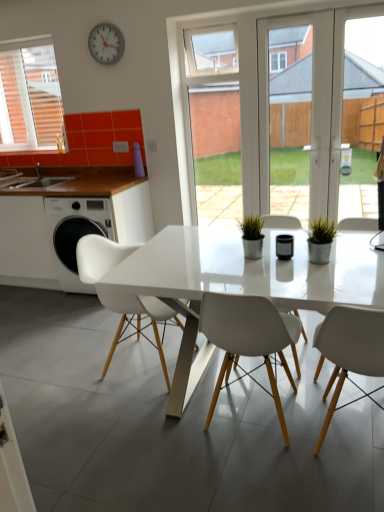
In order to click on vacant space in front of green matte plant at right in this screenshot , I will do pos(326,272).